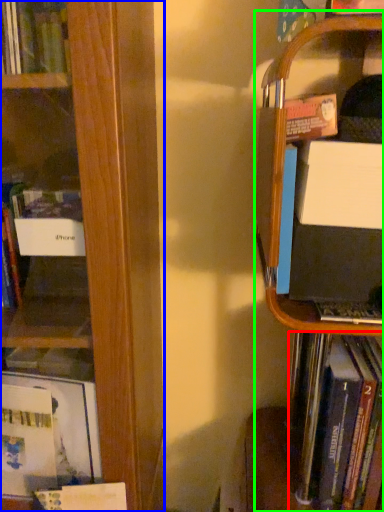
Question: Which is farther away from book (highlighted by a red box)? book (highlighted by a blue box) or bookshelf (highlighted by a green box)?

Choices:
 (A) book
 (B) bookshelf

Answer: (A)